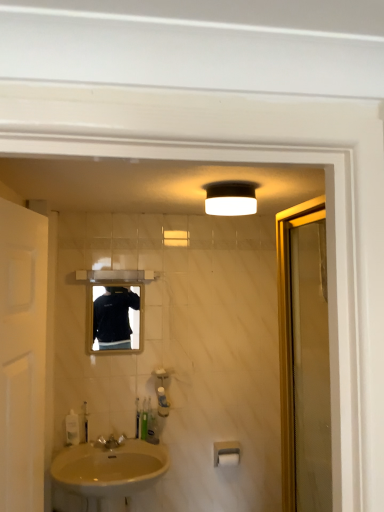
This screenshot has height=512, width=384. What are the coordinates of `free space between clear plastic bottle at lower left, the 1th toiletry when ordered from left to right, and green plastic toothbrush at lower center, which ranks as the second toiletry in left-to-right order` in the screenshot? It's located at (106, 442).